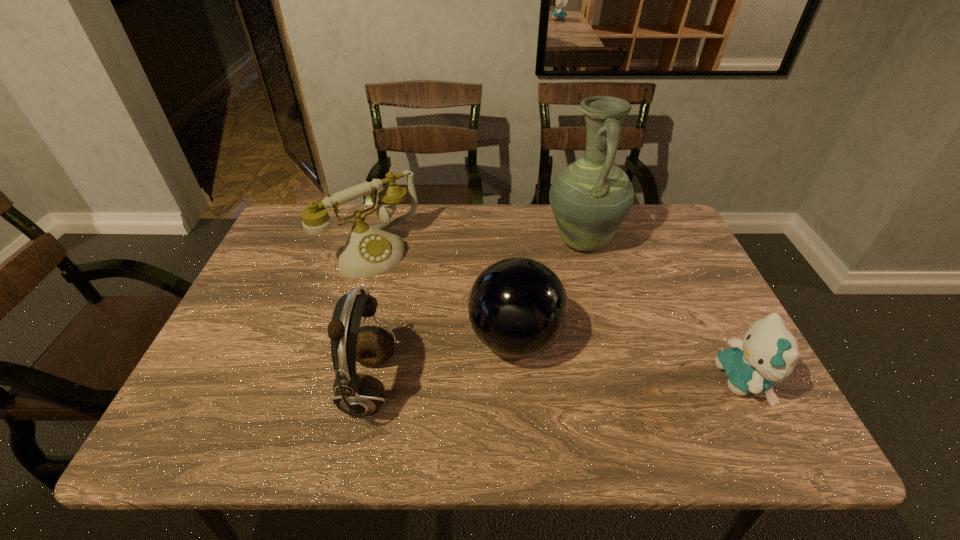
You are a GUI agent. You are given a task and a screenshot of the screen. Output one action in this format:
    pyautogui.click(x=<x>, y=<y>)
    Task: Click on the vacant space that satisfies the following two spatial constraints: 1. on the front side of the pitcher; 2. on the face of the kitten
    The height and width of the screenshot is (540, 960).
    Given the screenshot: What is the action you would take?
    pyautogui.click(x=620, y=381)

Locate an element on the screen. This screenshot has width=960, height=540. free space that satisfies the following two spatial constraints: 1. on the back side of the tallest object; 2. on the right side of the telephone is located at coordinates (374, 240).